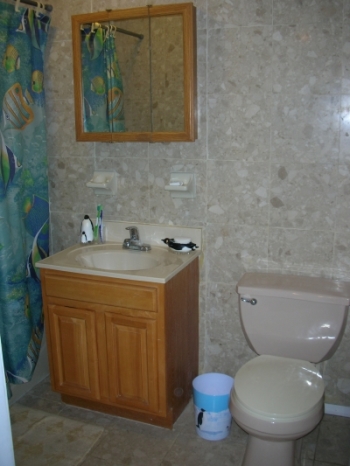
Find the location of a particular element. brown cabinet is located at coordinates (171, 313).